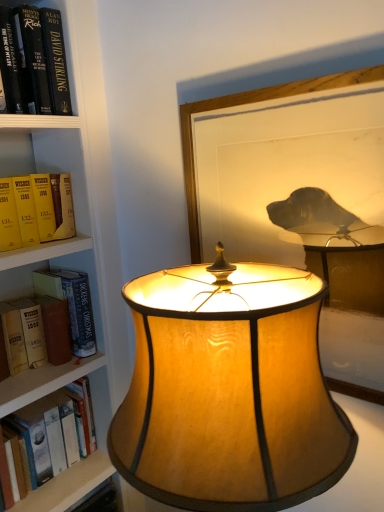
Where is `hardcover book at left`? This screenshot has width=384, height=512. hardcover book at left is located at coordinates (64, 314).

Would you say hardcover book at left is to the left or to the right of wooden framed picture at center in the picture?

Based on their positions, hardcover book at left is located to the left of wooden framed picture at center.

Which object is closer to the camera, hardcover book at left or wooden framed picture at center?

Positioned in front is wooden framed picture at center.

Based on the photo, is hardcover book at left positioned far away from wooden framed picture at center?

They are positioned close to each other.

Considering the sizes of objects hardcover book at left and wooden framed picture at center in the image provided, who is thinner, hardcover book at left or wooden framed picture at center?

Thinner between the two is wooden framed picture at center.

Is matte gold lampshade at center next to hardcover book at left and touching it?

They are not placed beside each other.

From a real-world perspective, between matte gold lampshade at center and hardcover book at left, who is vertically higher?

In real-world perspective, hardcover book at left is above.

Is matte gold lampshade at center positioned in front of hardcover book at left?

That is True.

Is hardcover book at left wider than matte gold lampshade at center?

In fact, hardcover book at left might be narrower than matte gold lampshade at center.

In the scene shown: Is hardcover book at left facing towards matte gold lampshade at center?

No, hardcover book at left is not oriented towards matte gold lampshade at center.

How many degrees apart are the facing directions of hardcover book at left and matte gold lampshade at center?

The facing directions of hardcover book at left and matte gold lampshade at center are 88.4 degrees apart.

Can you confirm if wooden framed picture at center is taller than matte gold lampshade at center?

No.

Which is closer, (269, 98) or (196, 493)?

Point (269, 98) is farther from the camera than point (196, 493).

From the image's perspective, is wooden framed picture at center on top of matte gold lampshade at center?

Yes, from the image's perspective, wooden framed picture at center is on top of matte gold lampshade at center.

Is wooden framed picture at center at the right side of hardcover book at left?

Correct, you'll find wooden framed picture at center to the right of hardcover book at left.

Identify the location of book that is behind the wooden framed picture at center. The image size is (384, 512). (64, 314).

Are wooden framed picture at center and hardcover book at left located far from each other?

No, wooden framed picture at center is in close proximity to hardcover book at left.

From the picture: Between hardcover book at left and matte gold lampshade at center, which one appears on the right side from the viewer's perspective?

matte gold lampshade at center is more to the right.

Is hardcover book at left turned away from matte gold lampshade at center?

hardcover book at left does not have its back to matte gold lampshade at center.

Would you say hardcover book at left is a long distance from matte gold lampshade at center?

No.

From the picture: Does hardcover book at left have a larger size compared to matte gold lampshade at center?

Actually, hardcover book at left might be smaller than matte gold lampshade at center.

Does point (202, 294) come farther from viewer compared to point (70, 347)?

No, (202, 294) is closer to viewer.

How different are the orientations of matte gold lampshade at center and hardcover book at left in degrees?

88.4 degrees.

I want to click on lamp in front of the hardcover book at left, so click(x=229, y=392).

Looking at this image, considering the sizes of matte gold lampshade at center and hardcover book at left in the image, is matte gold lampshade at center wider or thinner than hardcover book at left?

Considering their sizes, matte gold lampshade at center looks broader than hardcover book at left.

Where is `picture frame located in front of the hardcover book at left`? This screenshot has width=384, height=512. picture frame located in front of the hardcover book at left is located at coordinates (250, 104).

The image size is (384, 512). Find the location of `lamp that is under the hardcover book at left (from a real-world perspective)`. lamp that is under the hardcover book at left (from a real-world perspective) is located at coordinates (229, 392).

Estimate the real-world distances between objects in this image. Which object is closer to wooden framed picture at center, hardcover book at left or matte gold lampshade at center?

matte gold lampshade at center is positioned closer to the anchor wooden framed picture at center.

From the image, which object appears to be farther from wooden framed picture at center, hardcover book at left or matte gold lampshade at center?

hardcover book at left lies further to wooden framed picture at center than the other object.

Looking at the image, which one is located further to hardcover book at left, wooden framed picture at center or matte gold lampshade at center?

matte gold lampshade at center.

Considering their positions, is hardcover book at left positioned further to wooden framed picture at center than hardcover book at left?

Among the two, hardcover book at left is located further to wooden framed picture at center.

When comparing their distances from hardcover book at left, does matte gold lampshade at center or hardcover book at left seem closer?

hardcover book at left is positioned closer to the anchor hardcover book at left.

From the image, which object appears to be farther from matte gold lampshade at center, hardcover book at left or wooden framed picture at center?

hardcover book at left is further to matte gold lampshade at center.

When comparing their distances from matte gold lampshade at center, does hardcover book at left or hardcover book at left seem closer?

hardcover book at left is positioned closer to the anchor matte gold lampshade at center.

Which object lies further to the anchor point wooden framed picture at center, matte gold lampshade at center or hardcover book at left?

Based on the image, hardcover book at left appears to be further to wooden framed picture at center.

Locate an element on the screen. Image resolution: width=384 pixels, height=512 pixels. paperback book between matte gold lampshade at center and hardcover book at left along the z-axis is located at coordinates (55, 329).

Where is `book situated between hardcover book at left and wooden framed picture at center from left to right`? Image resolution: width=384 pixels, height=512 pixels. book situated between hardcover book at left and wooden framed picture at center from left to right is located at coordinates (64, 314).

Locate an element on the screen. picture frame between matte gold lampshade at center and hardcover book at left along the z-axis is located at coordinates (250, 104).

Find the location of a particular element. This screenshot has width=384, height=512. picture frame located between matte gold lampshade at center and hardcover book at left in the depth direction is located at coordinates (250, 104).